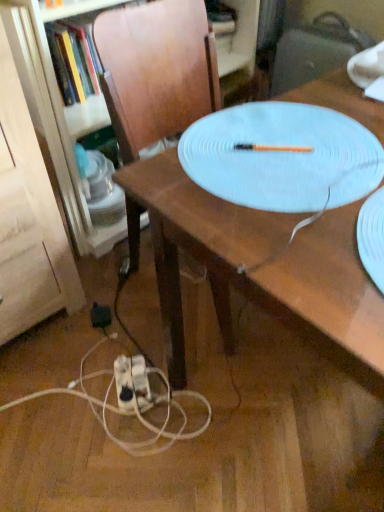
Locate an element on the screen. white plastic extension cord at lower center is located at coordinates (132, 383).

What is the approximate width of black plastic electric outlet at lower left?

black plastic electric outlet at lower left is 2.90 inches in width.

What do you see at coordinates (261, 270) in the screenshot? I see `wooden table at center` at bounding box center [261, 270].

Find the location of a particular element. This screenshot has width=384, height=512. white plastic extension cord at lower center is located at coordinates (132, 383).

From the image's perspective, which one is positioned higher, black plastic electric outlet at lower left or white plastic extension cord at lower center?

black plastic electric outlet at lower left.

Between black plastic electric outlet at lower left and white plastic extension cord at lower center, which one has more height?

With more height is white plastic extension cord at lower center.

Is black plastic electric outlet at lower left positioned beyond the bounds of white plastic extension cord at lower center?

black plastic electric outlet at lower left lies outside white plastic extension cord at lower center's area.

Which is less distant, [103,313] or [117,370]?

Point [103,313] is farther from the camera than point [117,370].

Is point (92, 322) in front of point (185, 131)?

No, (92, 322) is behind (185, 131).

Based on their positions, is black plastic electric outlet at lower left located to the left or right of white textured platter at center?

black plastic electric outlet at lower left is to the left of white textured platter at center.

Is black plastic electric outlet at lower left looking in the opposite direction of white textured platter at center?

No, black plastic electric outlet at lower left's orientation is not away from white textured platter at center.

Which object is thinner, black plastic electric outlet at lower left or white textured platter at center?

black plastic electric outlet at lower left is thinner.

Could you measure the distance between white textured platter at center and white plastic extension cord at lower center?

A distance of 29.87 inches exists between white textured platter at center and white plastic extension cord at lower center.

Would you say white textured platter at center is to the left or to the right of white plastic extension cord at lower center in the picture?

Clearly, white textured platter at center is on the right of white plastic extension cord at lower center in the image.

Where is `platter on the right of white plastic extension cord at lower center`? The image size is (384, 512). platter on the right of white plastic extension cord at lower center is located at coordinates (282, 157).

Does white textured platter at center have a greater height compared to white plastic extension cord at lower center?

Incorrect, the height of white textured platter at center is not larger of that of white plastic extension cord at lower center.

How different are the orientations of wooden table at center and white textured platter at center in degrees?

The angle between the facing direction of wooden table at center and the facing direction of white textured platter at center is 91.1 degrees.

From a real-world perspective, who is located higher, wooden table at center or white textured platter at center?

From a 3D spatial view, white textured platter at center is above.

Is wooden table at center thinner than white textured platter at center?

No, wooden table at center is not thinner than white textured platter at center.

Between point (184, 356) and point (235, 141), which one is positioned in front?

The point (235, 141) is closer.

Based on their positions, is white textured platter at center located to the left or right of black plastic electric outlet at lower left?

Based on their positions, white textured platter at center is located to the right of black plastic electric outlet at lower left.

From the image's perspective, is white textured platter at center located beneath black plastic electric outlet at lower left?

No, from the image's perspective, white textured platter at center is not below black plastic electric outlet at lower left.

Which is in front, point (358, 169) or point (95, 313)?

The point (358, 169) is closer.

Is white textured platter at center spatially inside black plastic electric outlet at lower left, or outside of it?

white textured platter at center is spatially situated outside black plastic electric outlet at lower left.

Which object is wider, white plastic extension cord at lower center or white textured platter at center?

With larger width is white textured platter at center.

From their relative heights in the image, would you say white plastic extension cord at lower center is taller or shorter than white textured platter at center?

In the image, white plastic extension cord at lower center appears to be taller than white textured platter at center.

From the image's perspective, which one is positioned lower, white plastic extension cord at lower center or white textured platter at center?

white plastic extension cord at lower center, from the image's perspective.

Are white plastic extension cord at lower center and white textured platter at center located far from each other?

No, white plastic extension cord at lower center is in close proximity to white textured platter at center.

Find the location of a particular element. table above the white plastic extension cord at lower center (from a real-world perspective) is located at coordinates (261, 270).

Would you consider white plastic extension cord at lower center to be distant from wooden table at center?

No, white plastic extension cord at lower center is not far from wooden table at center.

Does white plastic extension cord at lower center appear on the left side of wooden table at center?

Yes, white plastic extension cord at lower center is to the left of wooden table at center.

What's the angular difference between white plastic extension cord at lower center and wooden table at center's facing directions?

118 degrees separate the facing orientations of white plastic extension cord at lower center and wooden table at center.

There is a white plastic extension cord at lower center. Where is `electric outlet above it (from a real-world perspective)`? The image size is (384, 512). electric outlet above it (from a real-world perspective) is located at coordinates (100, 316).

At what (x,y) coordinates should I click in order to perform the action: click on electric outlet behind the white textured platter at center. Please return your answer as a coordinate pair (x, y). This screenshot has height=512, width=384. Looking at the image, I should click on (100, 316).

Looking at the image, which one is located further to white textured platter at center, white plastic extension cord at lower center or wooden table at center?

white plastic extension cord at lower center is positioned further to the anchor white textured platter at center.

Looking at this image, when comparing their distances from white plastic extension cord at lower center, does wooden table at center or black plastic electric outlet at lower left seem closer?

black plastic electric outlet at lower left is closer to white plastic extension cord at lower center.

Based on their spatial positions, is white plastic extension cord at lower center or black plastic electric outlet at lower left closer to wooden table at center?

white plastic extension cord at lower center lies closer to wooden table at center than the other object.

Based on their spatial positions, is black plastic electric outlet at lower left or wooden table at center closer to white textured platter at center?

wooden table at center is closer to white textured platter at center.

Which object lies nearer to the anchor point white textured platter at center, wooden table at center or black plastic electric outlet at lower left?

wooden table at center lies closer to white textured platter at center than the other object.

Consider the image. Looking at the image, which one is located closer to black plastic electric outlet at lower left, white plastic extension cord at lower center or wooden table at center?

white plastic extension cord at lower center lies closer to black plastic electric outlet at lower left than the other object.

Estimate the real-world distances between objects in this image. Which object is further from wooden table at center, black plastic electric outlet at lower left or white textured platter at center?

black plastic electric outlet at lower left is positioned further to the anchor wooden table at center.

Considering their positions, is white plastic extension cord at lower center positioned further to wooden table at center than white textured platter at center?

white plastic extension cord at lower center.

Locate an element on the screen. The height and width of the screenshot is (512, 384). extension cord between wooden table at center and black plastic electric outlet at lower left in the front-back direction is located at coordinates (132, 383).

The height and width of the screenshot is (512, 384). Identify the location of platter positioned between wooden table at center and black plastic electric outlet at lower left from near to far. (282, 157).

Where is `extension cord positioned between white textured platter at center and black plastic electric outlet at lower left from near to far`? extension cord positioned between white textured platter at center and black plastic electric outlet at lower left from near to far is located at coordinates (132, 383).

You are a GUI agent. You are given a task and a screenshot of the screen. Output one action in this format:
    pyautogui.click(x=<x>, y=<y>)
    Task: Click on the platter between wooden table at center and white plastic extension cord at lower center in the front-back direction
    This screenshot has width=384, height=512.
    Given the screenshot: What is the action you would take?
    pyautogui.click(x=282, y=157)